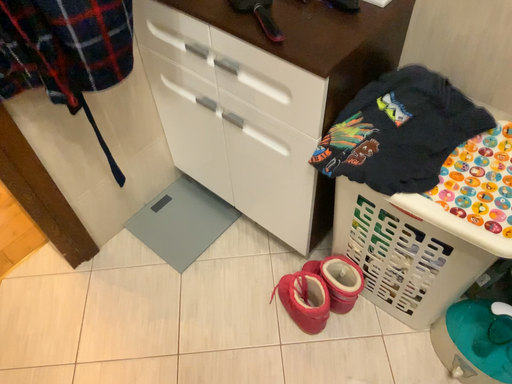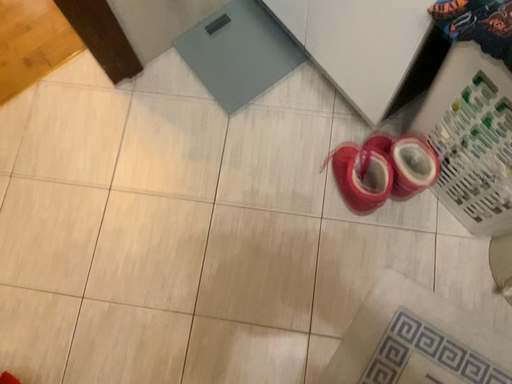
Question: Which way did the camera rotate in the video?

Choices:
 (A) rotated downward
 (B) rotated upward

Answer: (A)